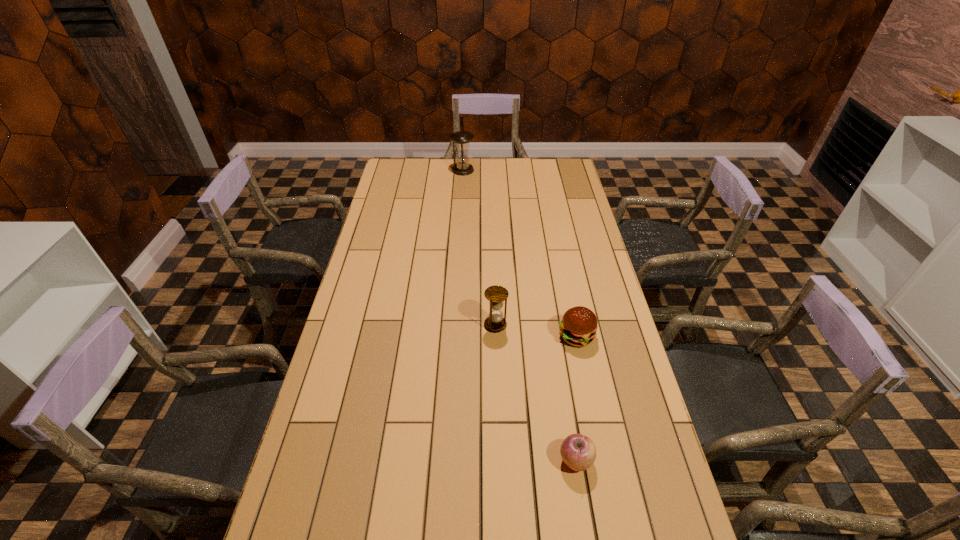
Find the location of a particular element. The width and height of the screenshot is (960, 540). the tallest object is located at coordinates (461, 139).

Where is `the leftmost object`? the leftmost object is located at coordinates (461, 139).

Image resolution: width=960 pixels, height=540 pixels. I want to click on the third object from right to left, so click(x=496, y=295).

This screenshot has height=540, width=960. I want to click on the right hourglass, so click(x=496, y=295).

Where is `hamburger`? Image resolution: width=960 pixels, height=540 pixels. hamburger is located at coordinates (578, 327).

Image resolution: width=960 pixels, height=540 pixels. What are the coordinates of `apple` in the screenshot? It's located at (578, 451).

Image resolution: width=960 pixels, height=540 pixels. Identify the location of vacant space positioned on the left of the leftmost object. (438, 170).

Identify the location of free space located on the right of the right hourglass. (550, 325).

Where is `vacant area located 0.400m on the left of the hamburger`? The width and height of the screenshot is (960, 540). vacant area located 0.400m on the left of the hamburger is located at coordinates (432, 336).

Where is `free space located on the left of the nearest object`? This screenshot has width=960, height=540. free space located on the left of the nearest object is located at coordinates (423, 461).